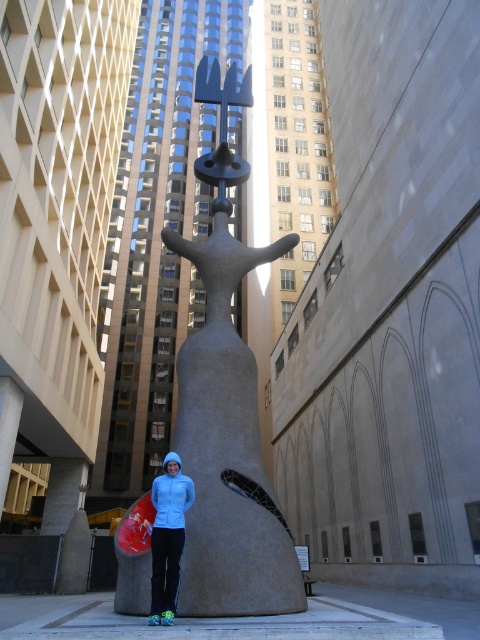
From the picture: Can you confirm if smooth gray statue at center is wider than light blue fleece at center?

Yes, smooth gray statue at center is wider than light blue fleece at center.

Who is taller, smooth gray statue at center or light blue fleece at center?

smooth gray statue at center

Which is in front, point (183, 392) or point (162, 504)?

Point (162, 504)

I want to click on smooth gray statue at center, so click(228, 410).

Which of these two, blue fleece jacket at center or light blue fleece at center, stands taller?

blue fleece jacket at center

Locate an element on the screen. Image resolution: width=480 pixels, height=640 pixels. blue fleece jacket at center is located at coordinates (168, 538).

Can you confirm if smooth gray statue at center is positioned above blue fleece jacket at center?

Correct, smooth gray statue at center is located above blue fleece jacket at center.

Where is `smooth gray statue at center`? This screenshot has width=480, height=640. smooth gray statue at center is located at coordinates (228, 410).

Locate an element on the screen. This screenshot has height=640, width=480. smooth gray statue at center is located at coordinates (228, 410).